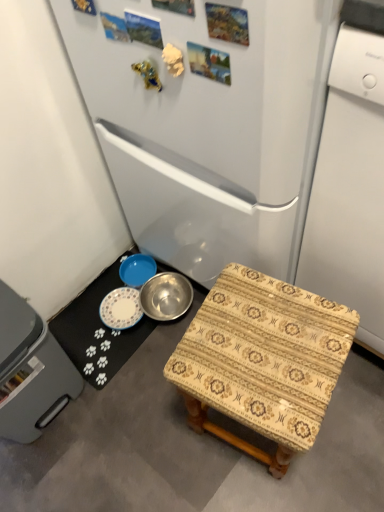
Where is `free space in front of patterned fabric stool at lower right`? This screenshot has height=512, width=384. free space in front of patterned fabric stool at lower right is located at coordinates (286, 487).